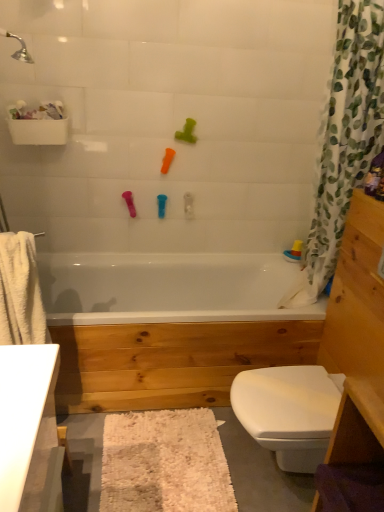
Identify the location of vacant space positioned to the left of translucent plastic boat at upper right, positioned as the fifth toy in top-to-bottom order. (269, 258).